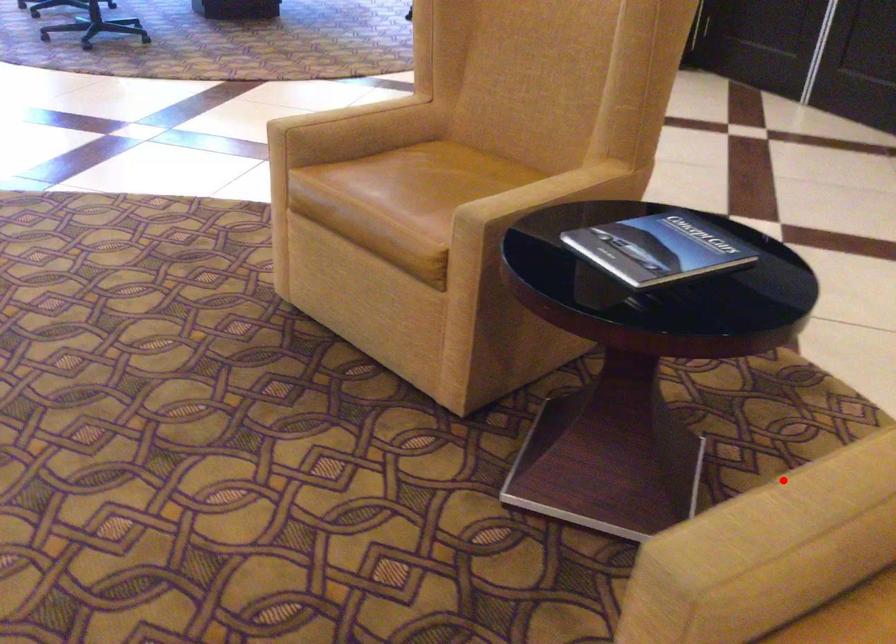
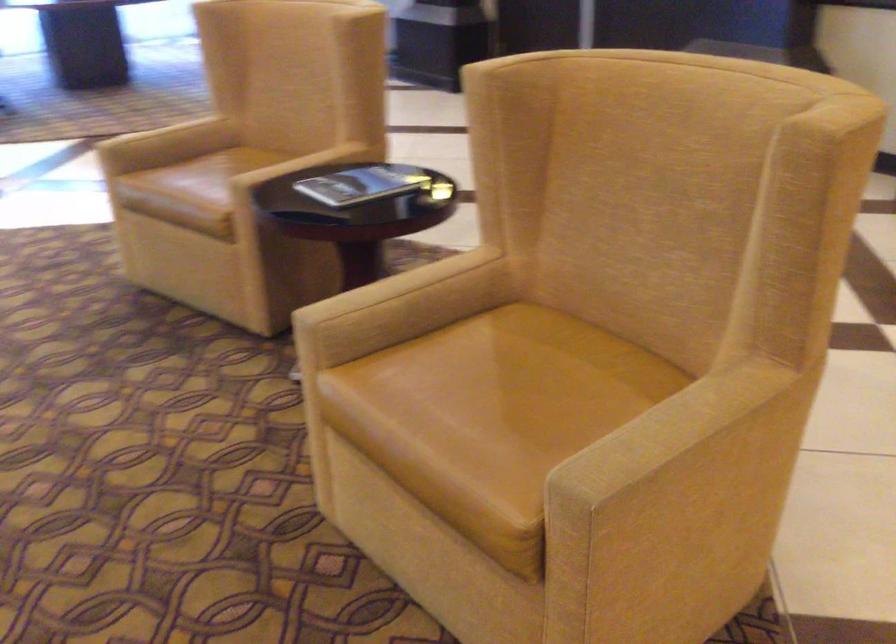
Locate, in the second image, the point that corresponds to the highlighted location in the first image.

(394, 286)